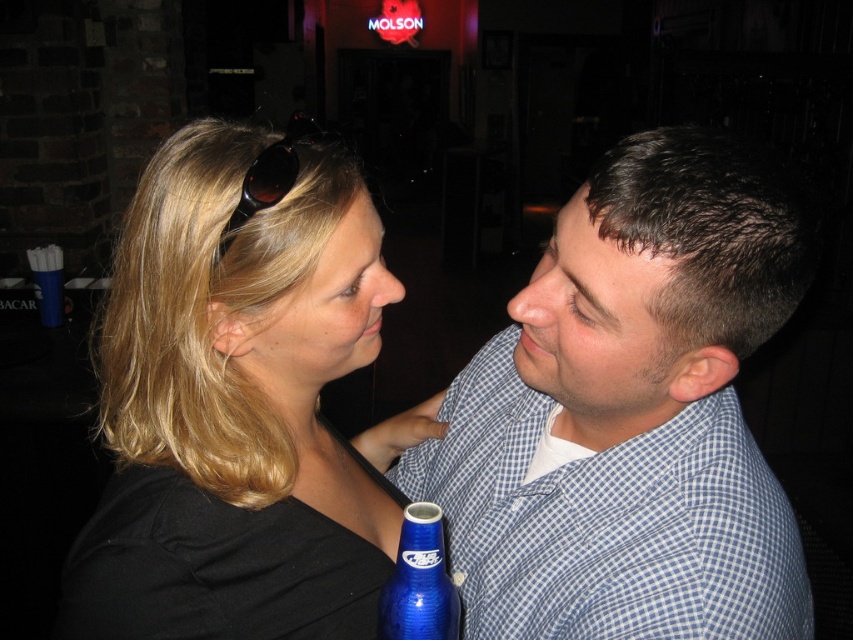
You are a photographer setting up for a portrait in the described scene. You need to adjust the camera focus so that both the black plastic sunglasses at upper center and the matte blonde hair at center are in sharp focus. Which object should you set as the focal point to ensure both are in focus?

The black plastic sunglasses at upper center has a greater height compared to matte blonde hair at center. Therefore, you should set the focal point on the black plastic sunglasses at upper center to ensure both objects are in sharp focus.

You are a photographer who needs to take a photo of the black plastic sunglasses at upper center and the camera. The minimum distance required between the two objects for the camera to focus properly is 20 inches. Can you take the photo without moving either object?

The black plastic sunglasses at upper center and camera are 22.35 inches apart from each other, which is more than the required 20 inches. Therefore, you can take the photo without moving either object.